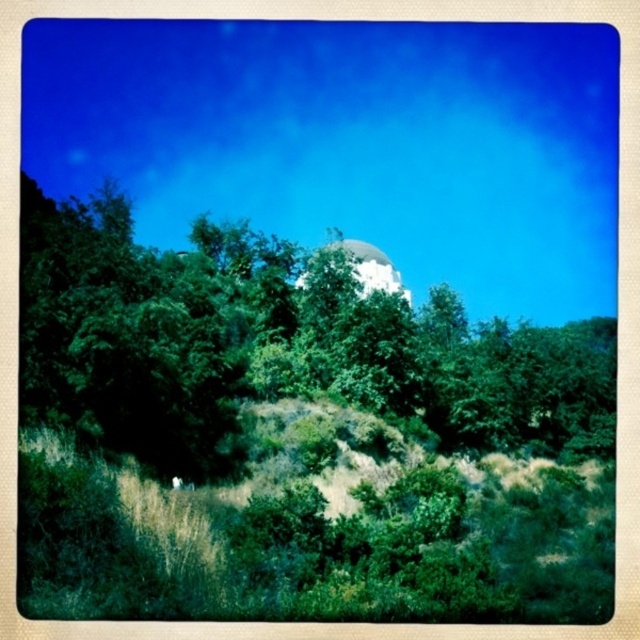
Based on the photo, you are standing at the base of the green grassy hillside at lower center and want to reach the white glossy dome at center. Which direction should you move to get closer to the dome?

You should move away from the green grassy hillside at lower center towards the white glossy dome at center since the dome is further away and the hillside is closer to you.

You are standing at the base of the green grassy hillside at lower center and want to walk towards the white glossy dome at center. Which direction should you head to reach the dome?

The green grassy hillside at lower center is positioned on the right side of the white glossy dome at center. To reach the dome, you should head to the left.

You are planning to take a photo of the white glossy dome at center without any obstruction. Given that the green leafy tree at center is blocking part of the dome, can you determine if the entire dome will be visible in your photo?

The green leafy tree at center is bigger than the white glossy dome at center, so it may block parts of the dome. To ensure the entire dome is visible, you might need to adjust your position or angle to avoid the tree.